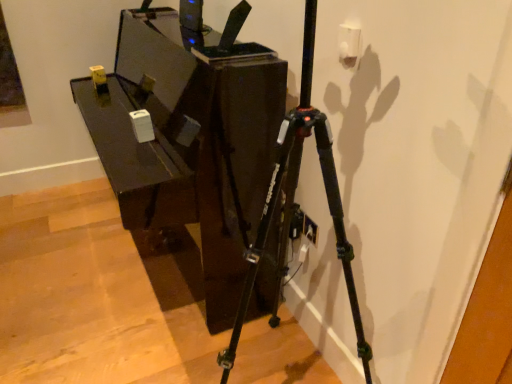
Identify the location of vacant area situated to the left side of glossy dark wood table at center. Image resolution: width=512 pixels, height=384 pixels. (52, 248).